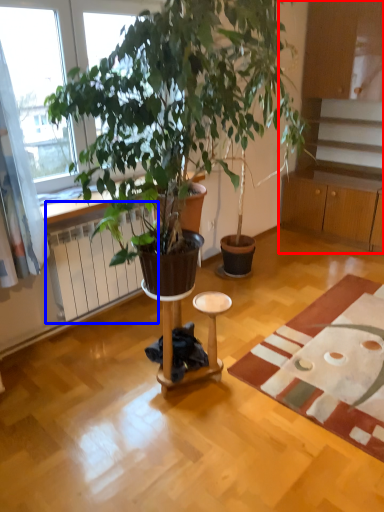
Question: Among these objects, which one is nearest to the camera, cabinetry (highlighted by a red box) or radiator (highlighted by a blue box)?

Choices:
 (A) cabinetry
 (B) radiator

Answer: (B)